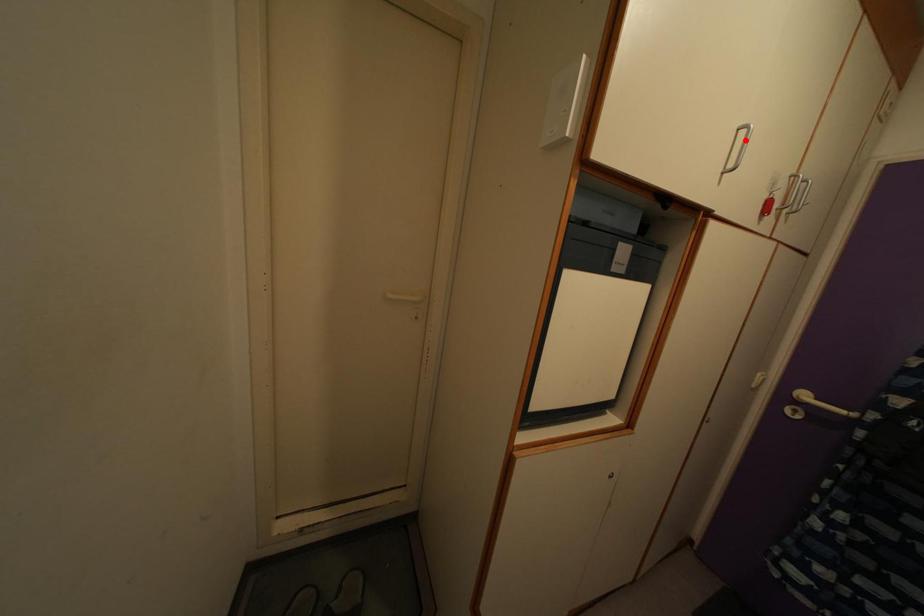
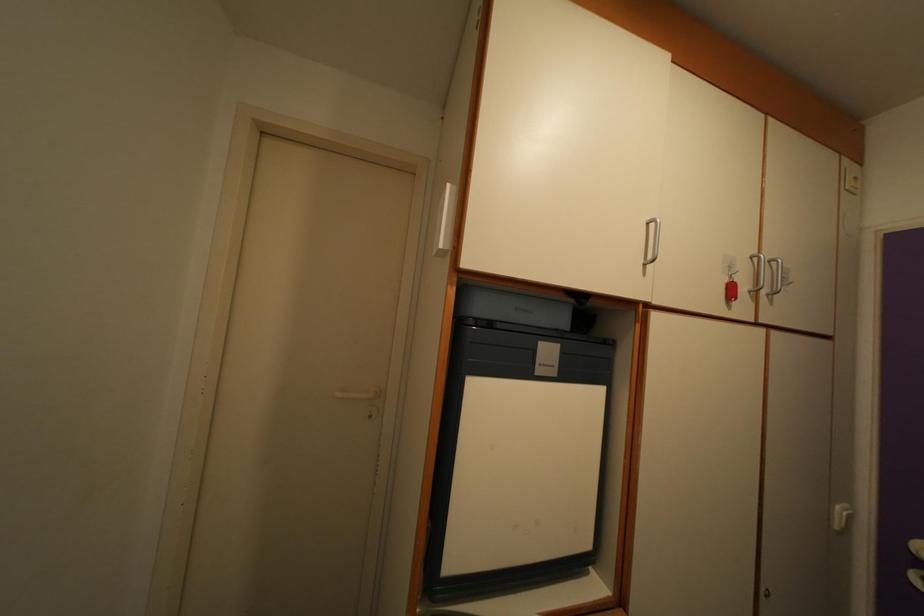
Locate, in the second image, the point that corresponds to the highlighted location in the first image.

(654, 233)